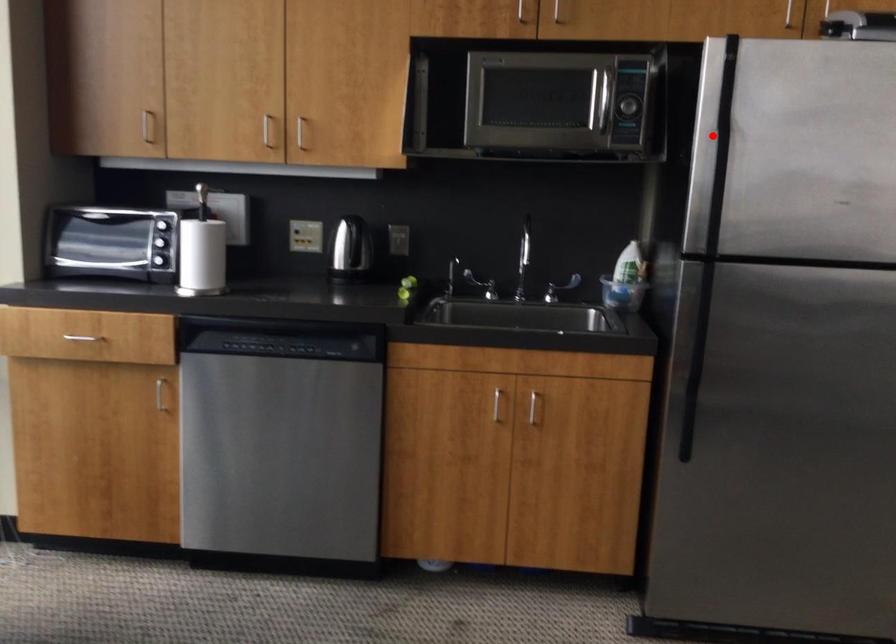
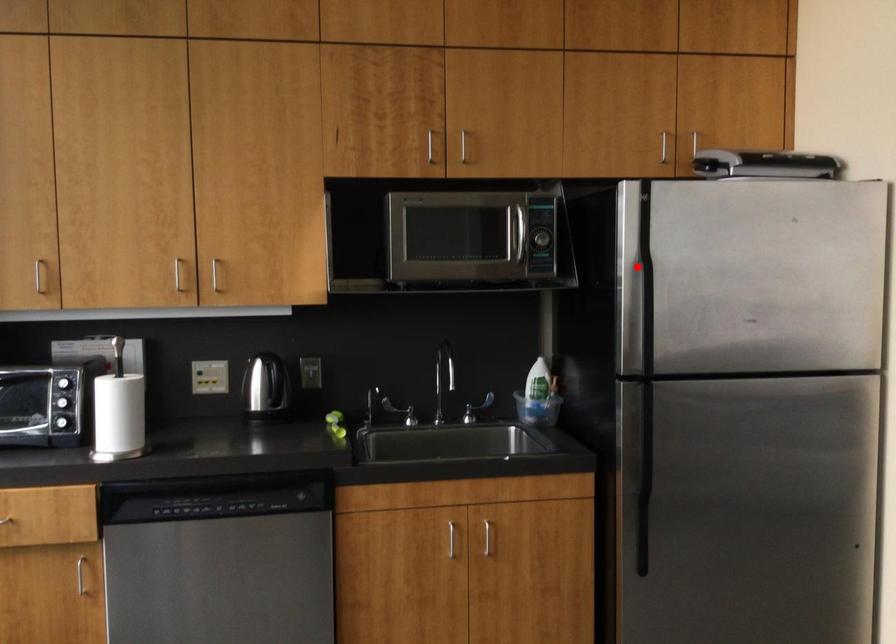
I am providing you with two images of the same scene from different viewpoints. A red point is marked on the first image and another point is marked on the second image. Is the red point in image1 aligned with the point shown in image2?

Yes